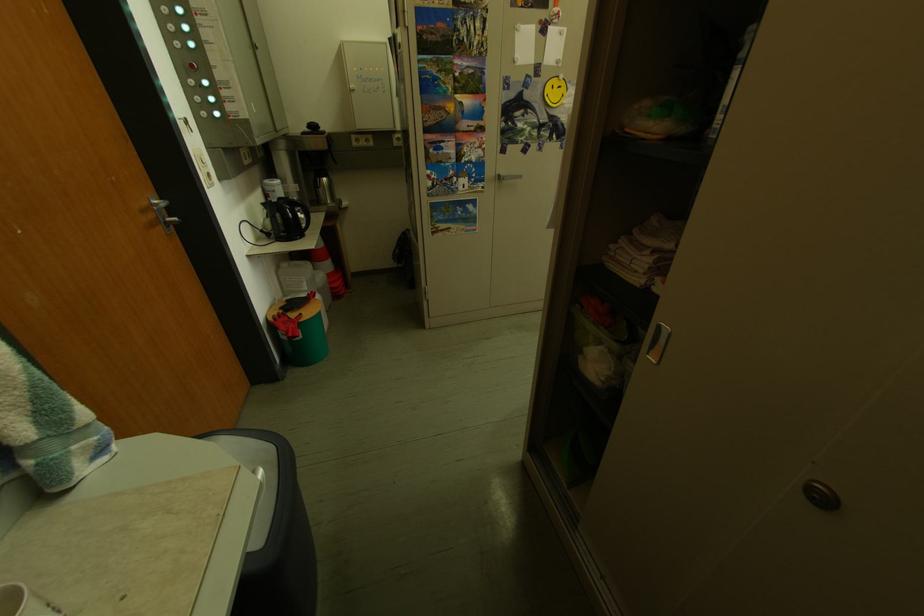
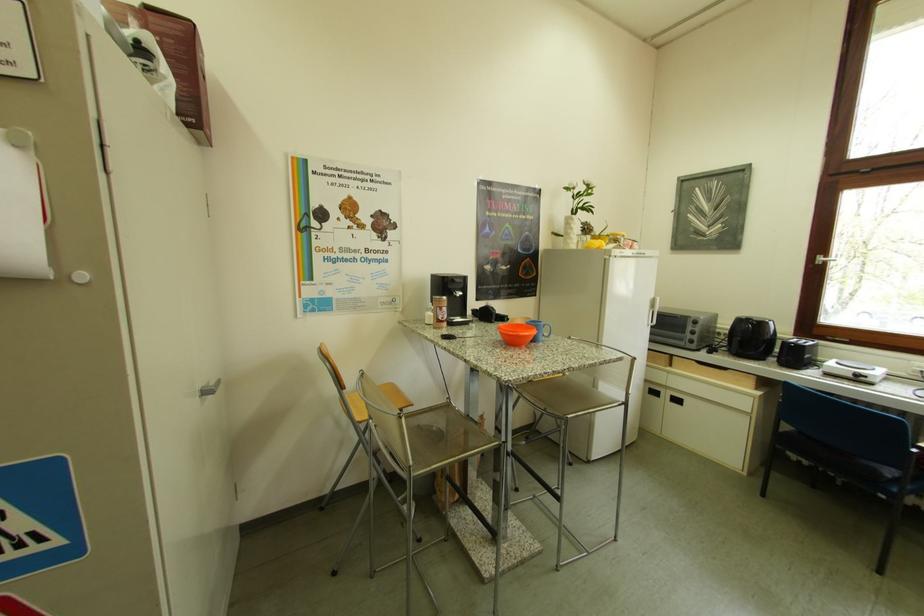
What movement of the cameraman would produce the second image?

The movement direction of the cameraman is right, forward.